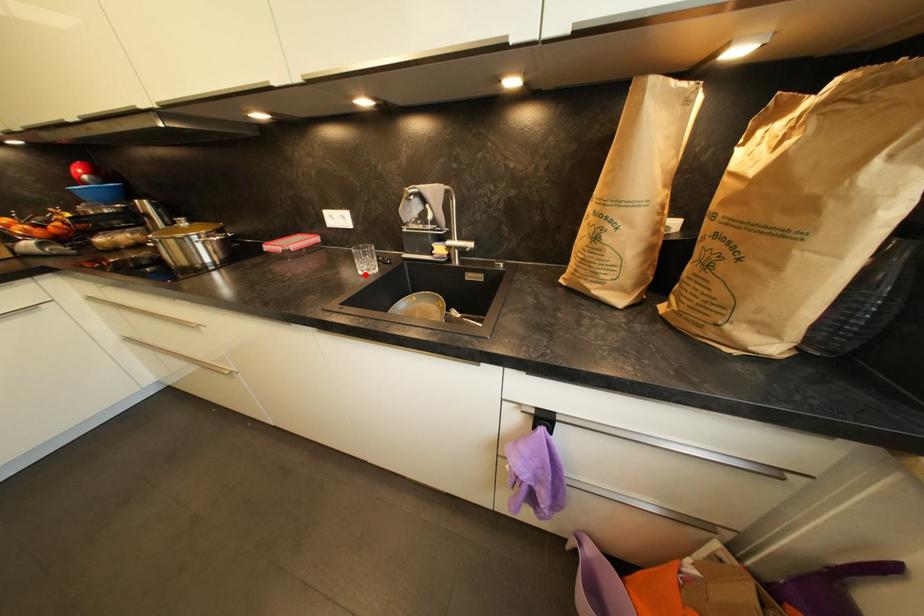
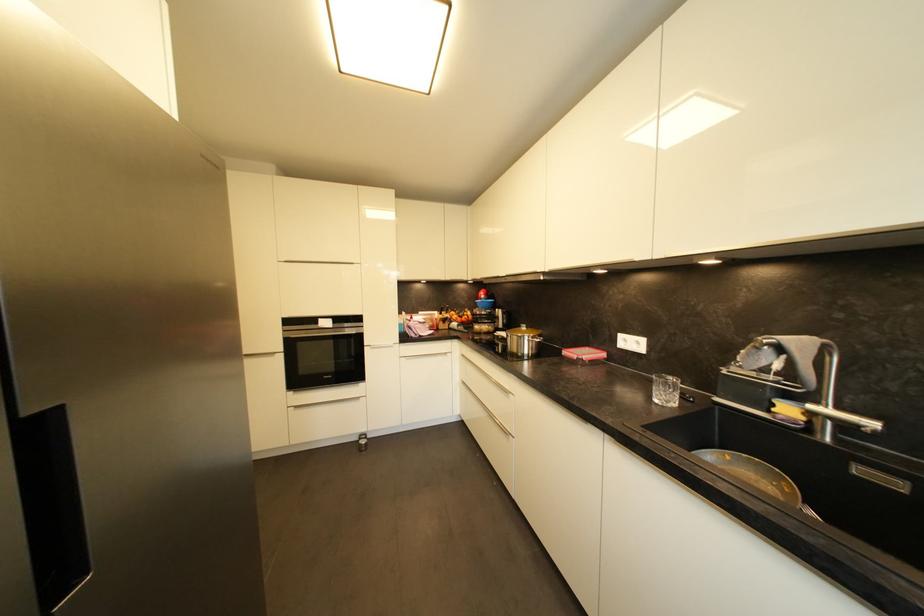
Question: I am providing you with two images of the same scene from different viewpoints. A red point is marked on the first image. Is the red point's position out of view in image 2?

Choices:
 (A) Yes
 (B) No

Answer: (B)